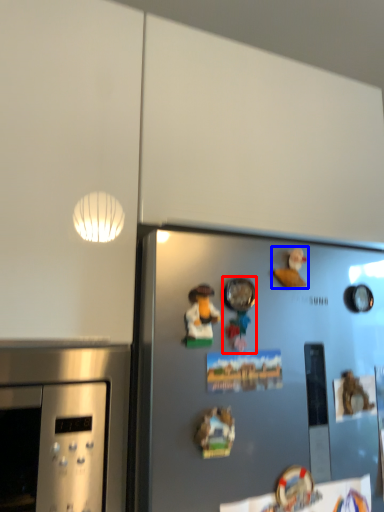
Question: Which point is further to the camera, toy (highlighted by a red box) or toy (highlighted by a blue box)?

Choices:
 (A) toy
 (B) toy

Answer: (B)